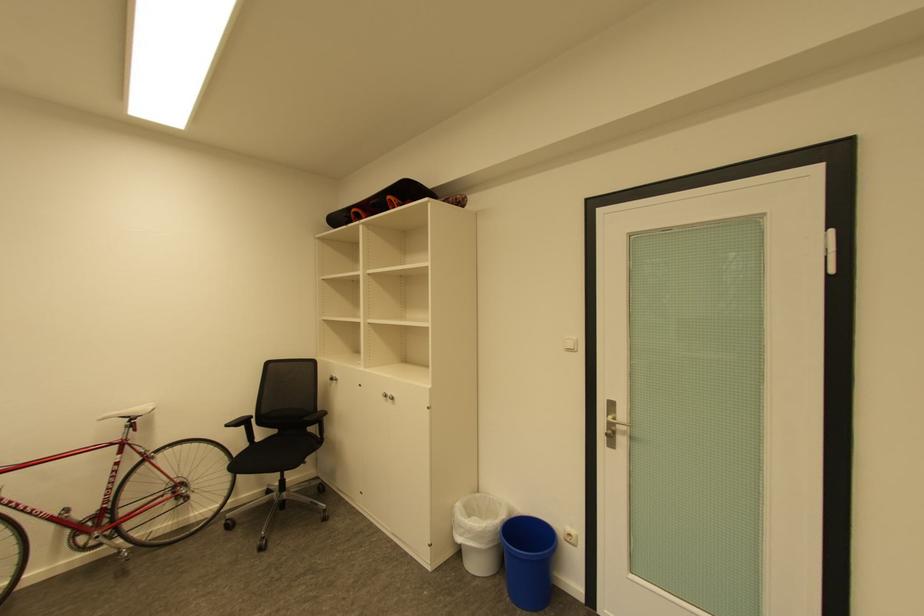
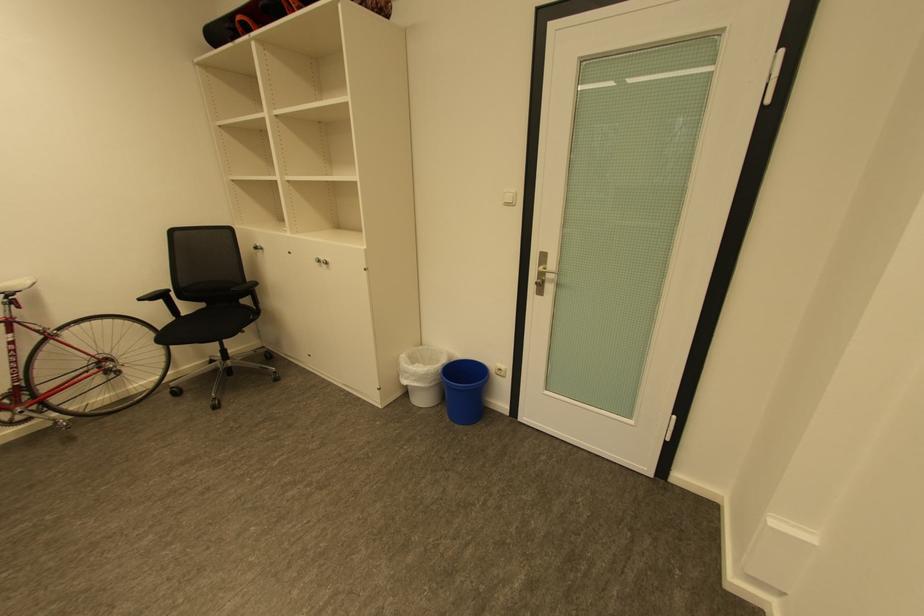
Locate, in the second image, the point that corresponds to point 235,426 in the first image.

(148, 300)